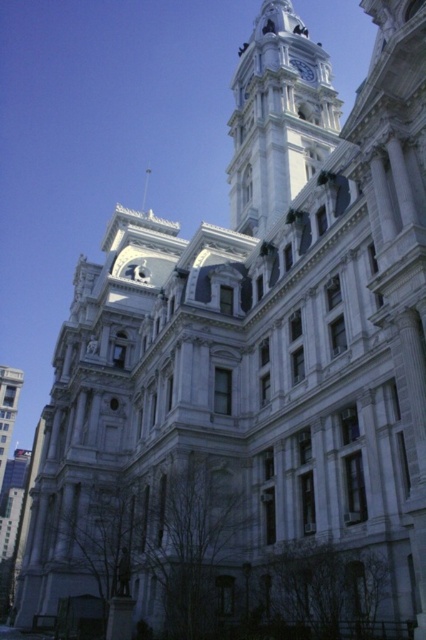
Question: Does white stone clock tower at upper center have a greater width compared to blue glossy clock at upper center?

Choices:
 (A) no
 (B) yes

Answer: (B)

Question: Among these objects, which one is farthest from the camera?

Choices:
 (A) white stone clock tower at upper center
 (B) blue glossy clock at upper center

Answer: (B)

Question: Which of the following is the closest to the observer?

Choices:
 (A) white stone clock tower at upper center
 (B) blue glossy clock at upper center

Answer: (A)

Question: Is white stone clock tower at upper center closer to camera compared to blue glossy clock at upper center?

Choices:
 (A) no
 (B) yes

Answer: (B)

Question: Does white stone clock tower at upper center have a smaller size compared to blue glossy clock at upper center?

Choices:
 (A) no
 (B) yes

Answer: (A)